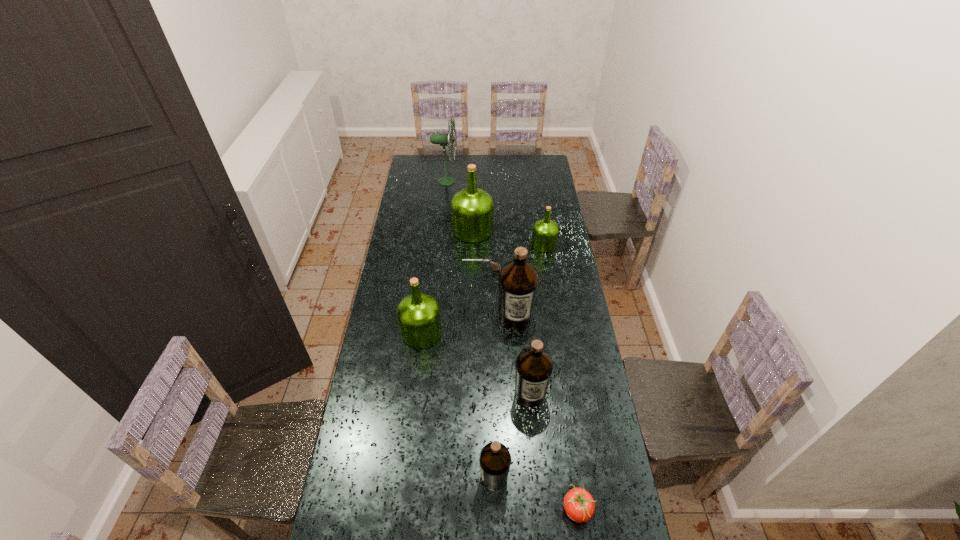
You are a GUI agent. You are given a task and a screenshot of the screen. Output one action in this format:
    pyautogui.click(x=<x>, y=<y>)
    Task: Click on the fan that is at the left edge
    The image size is (960, 540).
    Given the screenshot: What is the action you would take?
    pyautogui.click(x=442, y=139)

Where is `olive oil that is at the left edge`? This screenshot has height=540, width=960. olive oil that is at the left edge is located at coordinates (418, 314).

At what (x,y) coordinates should I click in order to perform the action: click on olive oil that is at the right edge. Please return your answer as a coordinate pair (x, y). Looking at the image, I should click on (545, 232).

Image resolution: width=960 pixels, height=540 pixels. What are the coordinates of `tomato that is at the right edge` in the screenshot? It's located at (579, 505).

Locate an element on the screen. The width and height of the screenshot is (960, 540). object present at the far left corner is located at coordinates (442, 139).

You are a GUI agent. You are given a task and a screenshot of the screen. Output one action in this format:
    pyautogui.click(x=<x>, y=<y>)
    Task: Click on the free space at the far edge of the desktop
    
    Given the screenshot: What is the action you would take?
    pyautogui.click(x=466, y=155)

This screenshot has width=960, height=540. Identify the location of free region at the left edge. (380, 345).

At what (x,y) coordinates should I click in order to perform the action: click on free spot at the right edge of the desktop. Please return your answer as a coordinate pair (x, y). Looking at the image, I should click on (563, 219).

Image resolution: width=960 pixels, height=540 pixels. Identify the location of vacant area that lies between the gun and the nearest olive oil. (x=488, y=374).

The image size is (960, 540). I want to click on free space between the second biggest brown olive oil and the fourth farthest object, so (506, 332).